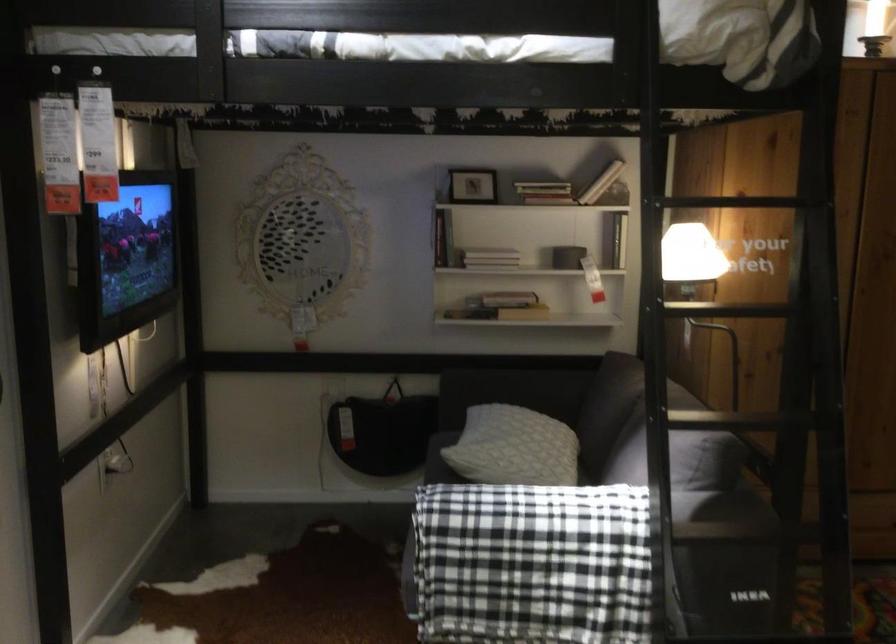
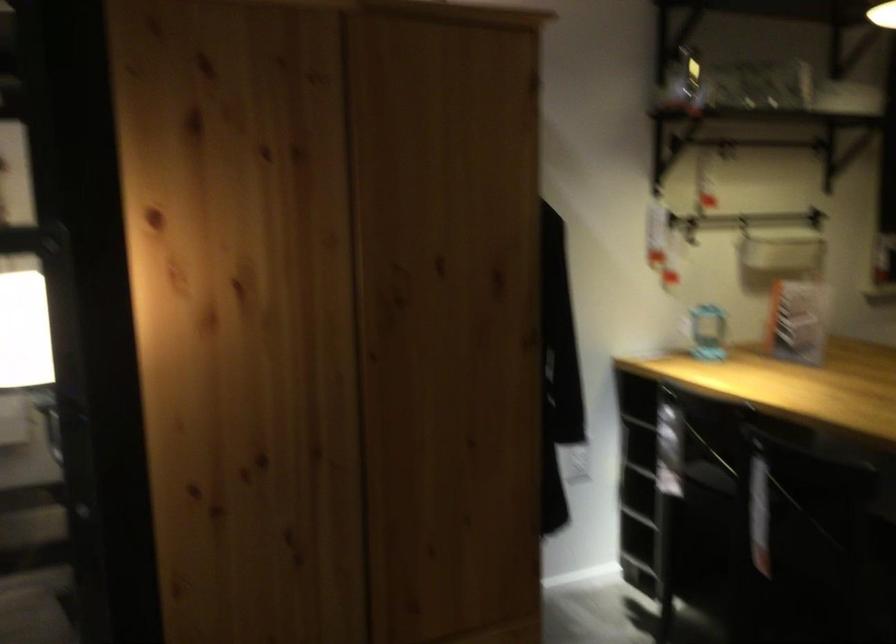
Consider the image. The images are taken continuously from a first-person perspective. In which direction are you moving?

The cameraman walked toward right, forward.